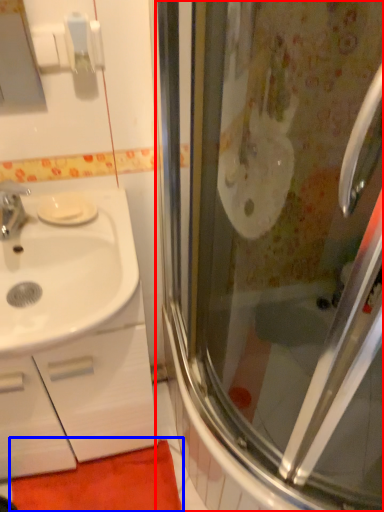
Question: Which point is further to the camera, screen door (highlighted by a red box) or bath mat (highlighted by a blue box)?

Choices:
 (A) screen door
 (B) bath mat

Answer: (B)